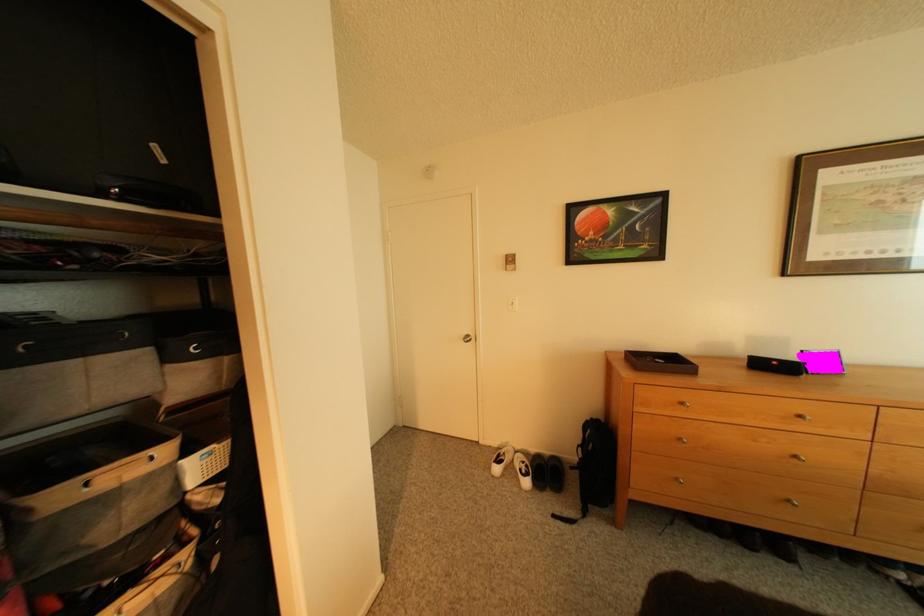
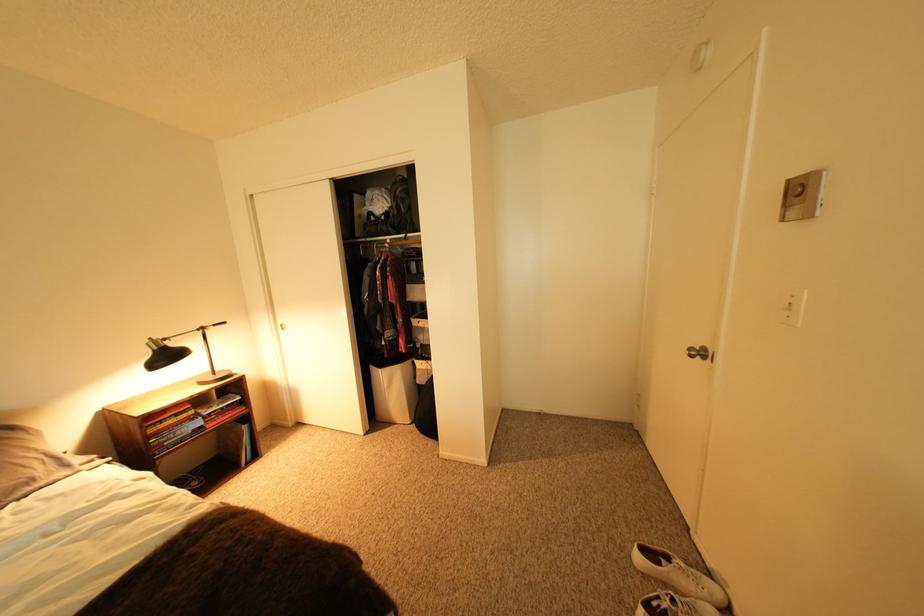
The point at (527, 267) is marked in the first image. Where is the corresponding point in the second image?

(816, 207)